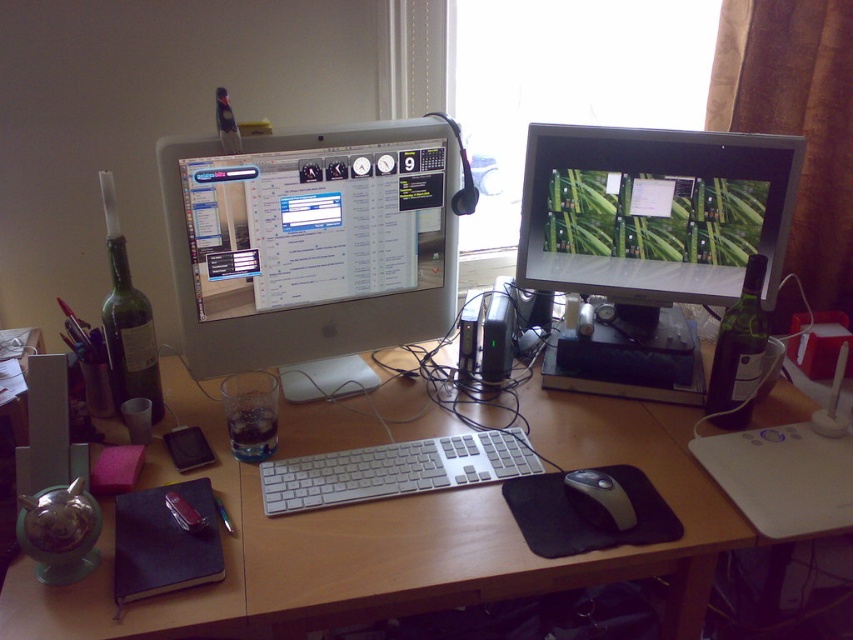
Question: In this image, where is white aluminum keyboard at center located relative to dark glass bottle at right?

Choices:
 (A) below
 (B) above

Answer: (A)

Question: Which object is farther from the camera taking this photo?

Choices:
 (A) white aluminum keyboard at center
 (B) green matte bottle at left
 (C) black rubber mouse at lower center

Answer: (B)

Question: Is wooden desk at center below black rubber mouse at lower center?

Choices:
 (A) no
 (B) yes

Answer: (A)

Question: Among these points, which one is nearest to the camera?

Choices:
 (A) (451, 593)
 (B) (157, 406)
 (C) (476, 448)

Answer: (A)

Question: Which object appears farthest from the camera in this image?

Choices:
 (A) white aluminum keyboard at center
 (B) wooden desk at center
 (C) satin silver monitor at center

Answer: (C)

Question: Does matte black monitor at center appear on the left side of dark glass bottle at right?

Choices:
 (A) yes
 (B) no

Answer: (A)